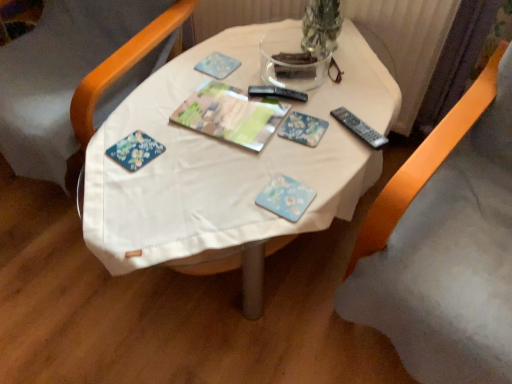
You are a GUI agent. You are given a task and a screenshot of the screen. Output one action in this format:
    pyautogui.click(x=<x>, y=<y>)
    Task: Click on the free space that is in between black plastic remote at right and blue floral coaster at center, the 2th paperback book viewed from the back
    This screenshot has width=512, height=384.
    Given the screenshot: What is the action you would take?
    pyautogui.click(x=328, y=164)